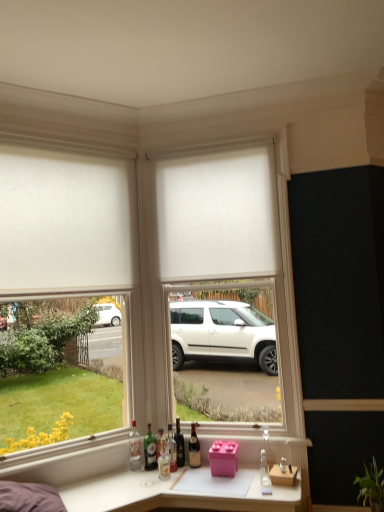
The image size is (384, 512). I want to click on vacant area that lies between clear glass bottle at center, the 3th bottle when ordered from left to right, and clear glass bottle at center, positioned as the seventh bottle in left-to-right order, so click(x=218, y=477).